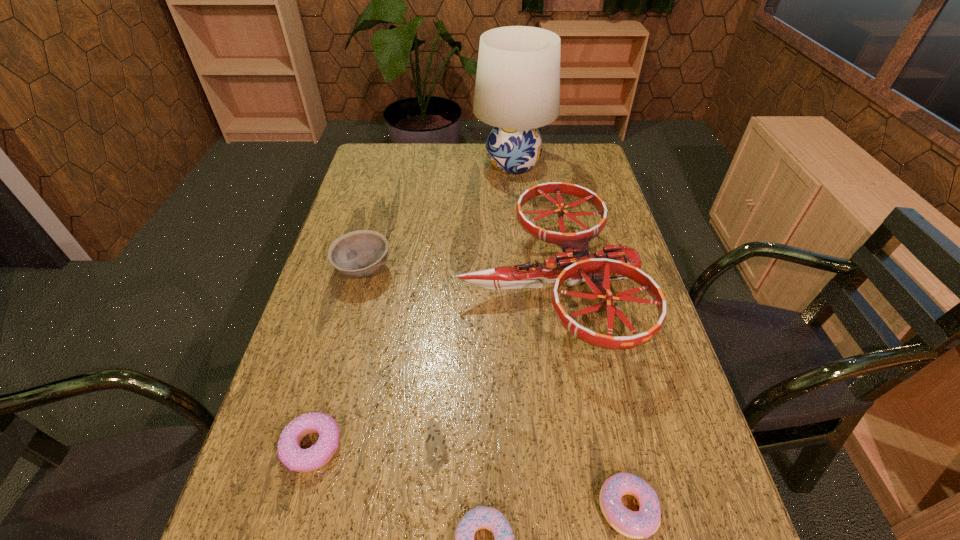
You are a GUI agent. You are given a task and a screenshot of the screen. Output one action in this format:
    pyautogui.click(x=<x>, y=<y>)
    Task: Click on the free space that is in between the farthest object and the bowl
    
    Given the screenshot: What is the action you would take?
    pyautogui.click(x=438, y=217)

You are a GUI agent. You are given a task and a screenshot of the screen. Output one action in this format:
    pyautogui.click(x=<x>, y=<y>)
    Task: Click on the vacant space in between the bowl and the drone
    Image resolution: width=960 pixels, height=540 pixels.
    Given the screenshot: What is the action you would take?
    pyautogui.click(x=455, y=276)

Where is `free spot between the third nearest object and the fifth shortest object`? free spot between the third nearest object and the fifth shortest object is located at coordinates (430, 364).

Locate an element on the screen. Image resolution: width=960 pixels, height=540 pixels. blank region between the drone and the bowl is located at coordinates (455, 276).

Locate an element on the screen. The width and height of the screenshot is (960, 540). object identified as the closest to the rightmost doughnut is located at coordinates (482, 517).

Locate an element on the screen. This screenshot has width=960, height=540. object identified as the third closest to the third tallest object is located at coordinates (517, 90).

Point out which doughnut is positioned as the nearest to the bowl. Please provide its 2D coordinates. Your answer should be formatted as a tuple, i.e. [(x, y)], where the tuple contains the x and y coordinates of a point satisfying the conditions above.

[(290, 453)]

Identify which doughnut is the second closest to the farthest doughnut. Please provide its 2D coordinates. Your answer should be formatted as a tuple, i.e. [(x, y)], where the tuple contains the x and y coordinates of a point satisfying the conditions above.

[(640, 524)]

Where is `free location that satisfies the following two spatial constraints: 1. on the front-facing side of the drone; 2. on the right side of the tallest object`? free location that satisfies the following two spatial constraints: 1. on the front-facing side of the drone; 2. on the right side of the tallest object is located at coordinates (525, 284).